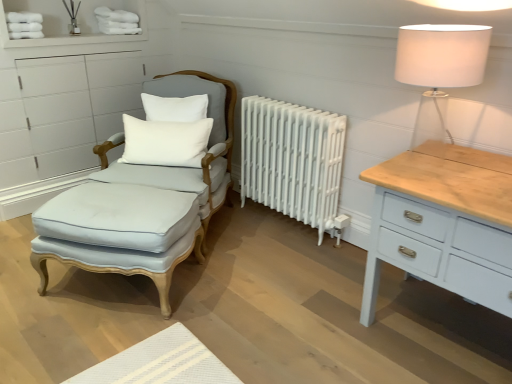
Locate an element on the screen. light blue fabric footrest at left is located at coordinates (120, 232).

What is the approximate width of light blue fabric footrest at left?

It is 21.63 inches.

I want to click on light blue fabric footrest at left, so click(x=120, y=232).

Find the location of a particular element. The height and width of the screenshot is (384, 512). pillow located below the white cotton pillow at upper center, the second pillow ordered from the bottom (from the image's perspective) is located at coordinates (165, 142).

Is white cotton pillow at upper center, which ranks as the first pillow in top-to-bottom order, taller than white cotton pillow at center, the first pillow in the bottom-to-top sequence?

No.

Are white cotton pillow at upper center, which ranks as the first pillow in top-to-bottom order, and white cotton pillow at center, placed as the 2th pillow when sorted from top to bottom, beside each other?

white cotton pillow at upper center, which ranks as the first pillow in top-to-bottom order, and white cotton pillow at center, placed as the 2th pillow when sorted from top to bottom, are not in contact.

How far apart are white cotton pillow at upper center, which ranks as the first pillow in top-to-bottom order, and white cotton pillow at center, placed as the 2th pillow when sorted from top to bottom?

A distance of 15.24 centimeters exists between white cotton pillow at upper center, which ranks as the first pillow in top-to-bottom order, and white cotton pillow at center, placed as the 2th pillow when sorted from top to bottom.

Who is shorter, light blue fabric footrest at left or white cotton pillow at upper center, which ranks as the first pillow in top-to-bottom order?

Standing shorter between the two is white cotton pillow at upper center, which ranks as the first pillow in top-to-bottom order.

Is light blue fabric footrest at left directly adjacent to white cotton pillow at upper center, the second pillow ordered from the bottom?

light blue fabric footrest at left and white cotton pillow at upper center, the second pillow ordered from the bottom, are not in contact.

Is point (125, 235) positioned in front of point (178, 120)?

Yes.

The height and width of the screenshot is (384, 512). In order to click on footrest on the left side of white cotton pillow at upper center, which ranks as the first pillow in top-to-bottom order in this screenshot , I will do `click(120, 232)`.

From a real-world perspective, who is located higher, white cotton pillow at center, the first pillow in the bottom-to-top sequence, or light blue fabric footrest at left?

white cotton pillow at center, the first pillow in the bottom-to-top sequence.

Which object is further away from the camera, white cotton pillow at center, the first pillow in the bottom-to-top sequence, or light blue fabric footrest at left?

white cotton pillow at center, the first pillow in the bottom-to-top sequence.

Is point (155, 145) closer or farther from the camera than point (44, 205)?

Point (155, 145) is closer to the camera than point (44, 205).

From the picture: Can you tell me how much white cotton pillow at center, the first pillow in the bottom-to-top sequence, and light blue fabric footrest at left differ in facing direction?

4.23 degrees separate the facing orientations of white cotton pillow at center, the first pillow in the bottom-to-top sequence, and light blue fabric footrest at left.

Who is taller, white cotton pillow at upper center, the second pillow ordered from the bottom, or white painted metal radiator at center?

white painted metal radiator at center.

Is white cotton pillow at upper center, which ranks as the first pillow in top-to-bottom order, facing away from white painted metal radiator at center?

white cotton pillow at upper center, which ranks as the first pillow in top-to-bottom order, is not turned away from white painted metal radiator at center.

Which of these two, white cotton pillow at upper center, which ranks as the first pillow in top-to-bottom order, or white painted metal radiator at center, is thinner?

Thinner between the two is white cotton pillow at upper center, which ranks as the first pillow in top-to-bottom order.

What's the angular difference between white cotton pillow at upper center, which ranks as the first pillow in top-to-bottom order, and light blue fabric swivel chair at left's facing directions?

There is a 0.0204-degree angle between the facing directions of white cotton pillow at upper center, which ranks as the first pillow in top-to-bottom order, and light blue fabric swivel chair at left.

Which is in front, point (164, 109) or point (108, 180)?

The point (108, 180) is more forward.

From the image's perspective, which object appears higher, white cotton pillow at upper center, the second pillow ordered from the bottom, or light blue fabric swivel chair at left?

white cotton pillow at upper center, the second pillow ordered from the bottom, is shown above in the image.

Based on the photo, which of these two, white cotton pillow at upper center, the second pillow ordered from the bottom, or light blue fabric swivel chair at left, is bigger?

Bigger between the two is light blue fabric swivel chair at left.

Considering the positions of point (230, 109) and point (257, 144), is point (230, 109) closer or farther from the camera than point (257, 144)?

Point (230, 109) is positioned farther from the camera compared to point (257, 144).

In the image, is light blue fabric swivel chair at left positioned in front of or behind white painted metal radiator at center?

light blue fabric swivel chair at left is in front of white painted metal radiator at center.

Is light blue fabric swivel chair at left in contact with white painted metal radiator at center?

light blue fabric swivel chair at left and white painted metal radiator at center are clearly separated.

Is light blue fabric swivel chair at left positioned beyond the bounds of white painted metal radiator at center?

Absolutely, light blue fabric swivel chair at left is external to white painted metal radiator at center.

Does light blue fabric swivel chair at left turn towards white fabric lampshade at upper right?

No, light blue fabric swivel chair at left is not oriented towards white fabric lampshade at upper right.

Is light blue fabric swivel chair at left not close to white fabric lampshade at upper right?

light blue fabric swivel chair at left is positioned a significant distance from white fabric lampshade at upper right.

Locate an element on the screen. The width and height of the screenshot is (512, 384). pillow below the white cotton pillow at upper center, which ranks as the first pillow in top-to-bottom order (from the image's perspective) is located at coordinates (165, 142).

From the image's perspective, which pillow is the 2nd one above the light blue fabric footrest at left? Please provide its 2D coordinates.

[(175, 108)]

Which object lies nearer to the anchor point light blue fabric footrest at left, light blue fabric swivel chair at left or white painted metal radiator at center?

The object closer to light blue fabric footrest at left is light blue fabric swivel chair at left.

Based on their spatial positions, is light blue fabric footrest at left or light blue fabric swivel chair at left closer to white cotton pillow at upper center, the second pillow ordered from the bottom?

light blue fabric swivel chair at left is closer to white cotton pillow at upper center, the second pillow ordered from the bottom.

Considering their positions, is white cotton pillow at center, the first pillow in the bottom-to-top sequence, positioned closer to light blue fabric swivel chair at left than light blue fabric footrest at left?

white cotton pillow at center, the first pillow in the bottom-to-top sequence, lies closer to light blue fabric swivel chair at left than the other object.

Based on their spatial positions, is white fabric lampshade at upper right or white cotton pillow at upper center, which ranks as the first pillow in top-to-bottom order, closer to light blue fabric swivel chair at left?

white cotton pillow at upper center, which ranks as the first pillow in top-to-bottom order, is positioned closer to the anchor light blue fabric swivel chair at left.

Looking at the image, which one is located further to light blue fabric swivel chair at left, light blue fabric footrest at left or white fabric lampshade at upper right?

white fabric lampshade at upper right is positioned further to the anchor light blue fabric swivel chair at left.

Which object lies nearer to the anchor point white fabric lampshade at upper right, light blue fabric swivel chair at left or white cotton pillow at center, placed as the 2th pillow when sorted from top to bottom?

white cotton pillow at center, placed as the 2th pillow when sorted from top to bottom, is closer to white fabric lampshade at upper right.

Considering their positions, is white cotton pillow at upper center, the second pillow ordered from the bottom, positioned further to white cotton pillow at center, placed as the 2th pillow when sorted from top to bottom, than white painted metal radiator at center?

Among the two, white painted metal radiator at center is located further to white cotton pillow at center, placed as the 2th pillow when sorted from top to bottom.

Looking at the image, which one is located closer to white cotton pillow at upper center, the second pillow ordered from the bottom, white fabric lampshade at upper right or white painted metal radiator at center?

Based on the image, white painted metal radiator at center appears to be nearer to white cotton pillow at upper center, the second pillow ordered from the bottom.

The image size is (512, 384). Find the location of `radiator situated between white cotton pillow at center, the first pillow in the bottom-to-top sequence, and white fabric lampshade at upper right from left to right`. radiator situated between white cotton pillow at center, the first pillow in the bottom-to-top sequence, and white fabric lampshade at upper right from left to right is located at coordinates (293, 161).

Image resolution: width=512 pixels, height=384 pixels. In order to click on radiator between white cotton pillow at upper center, which ranks as the first pillow in top-to-bottom order, and white fabric lampshade at upper right in this screenshot , I will do `click(293, 161)`.

Locate an element on the screen. The image size is (512, 384). pillow between light blue fabric swivel chair at left and white cotton pillow at upper center, the second pillow ordered from the bottom, from front to back is located at coordinates (165, 142).

Identify the location of swivel chair between light blue fabric footrest at left and white fabric lampshade at upper right in the horizontal direction. The height and width of the screenshot is (384, 512). (201, 158).